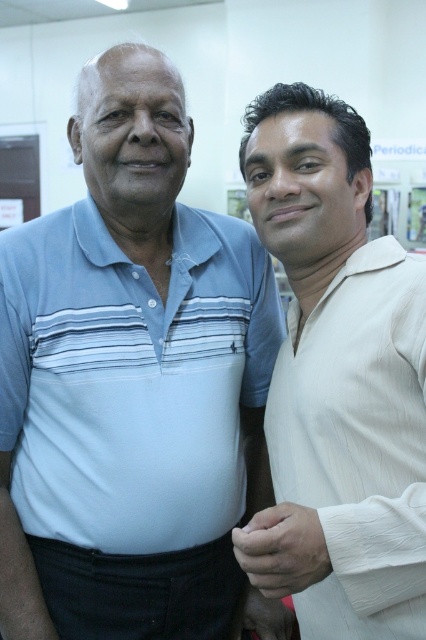
Who is lower down, light blue striped polo shirt at left or white silk shirt at right?

light blue striped polo shirt at left

Measure the distance between light blue striped polo shirt at left and white silk shirt at right.

light blue striped polo shirt at left and white silk shirt at right are 8.63 inches apart from each other.

Which is in front, point (245, 317) or point (408, 452)?

Point (408, 452)

What are the coordinates of `light blue striped polo shirt at left` in the screenshot? It's located at (132, 385).